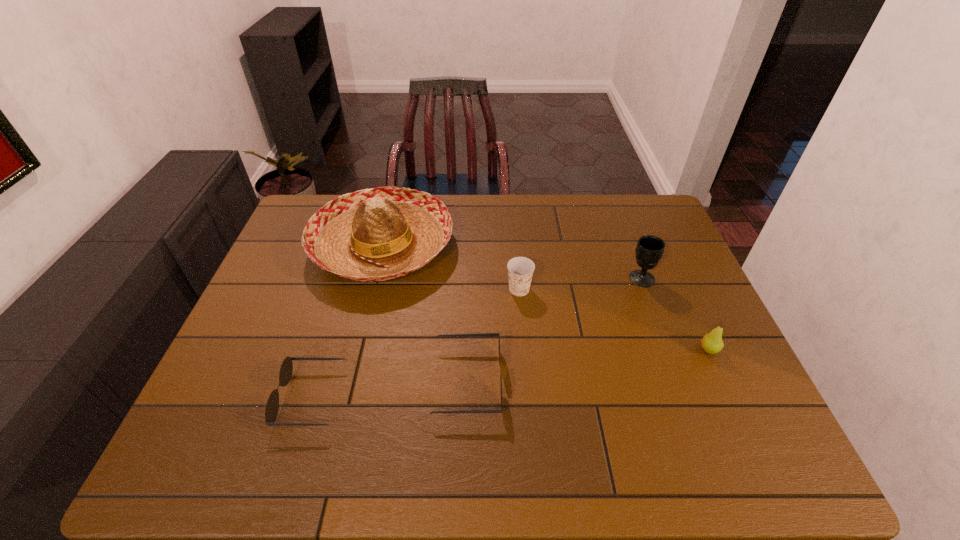
In the image, there is a desktop. Identify the location of free space at the far edge. The width and height of the screenshot is (960, 540). (578, 204).

You are a GUI agent. You are given a task and a screenshot of the screen. Output one action in this format:
    pyautogui.click(x=<x>, y=<y>)
    Task: Click on the free region at the right edge of the desktop
    The image size is (960, 540).
    Given the screenshot: What is the action you would take?
    pyautogui.click(x=694, y=279)

Locate an element on the screen. vacant area at the far left corner is located at coordinates (304, 206).

This screenshot has width=960, height=540. Identify the location of vacant space at the far right corner of the desktop. (631, 230).

The width and height of the screenshot is (960, 540). Identify the location of vacant area that lies between the Dixie cup and the rightmost object. (614, 319).

Where is `vacant region between the sombrero and the shortest object`? This screenshot has width=960, height=540. vacant region between the sombrero and the shortest object is located at coordinates (348, 322).

This screenshot has height=540, width=960. In order to click on vacant space that's between the taller sunglasses and the second tallest object in this screenshot , I will do `click(554, 329)`.

Image resolution: width=960 pixels, height=540 pixels. I want to click on vacant space in between the rightmost object and the taller sunglasses, so click(x=588, y=365).

Identify the location of unoccupied area between the sombrero and the shorter sunglasses. The width and height of the screenshot is (960, 540). (348, 322).

Locate an element on the screen. The width and height of the screenshot is (960, 540). object that is the fourth closest one to the taller sunglasses is located at coordinates (649, 250).